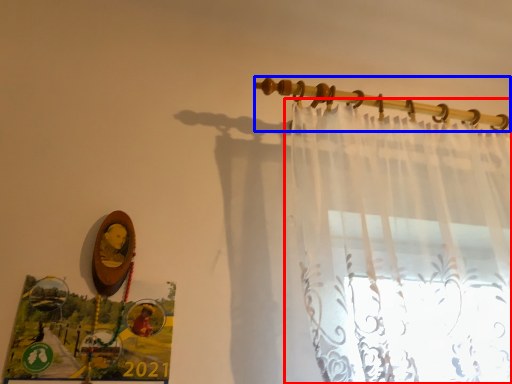
Question: Which object is further to the camera taking this photo, curtain (highlighted by a red box) or clothesline (highlighted by a blue box)?

Choices:
 (A) curtain
 (B) clothesline

Answer: (B)